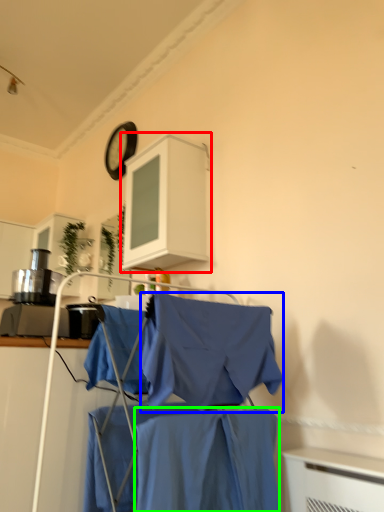
Question: Based on their relative distances, which object is nearer to cabinetry (highlighted by a red box)? Choose from cloak (highlighted by a blue box) and fabric (highlighted by a green box).

Choices:
 (A) cloak
 (B) fabric

Answer: (A)